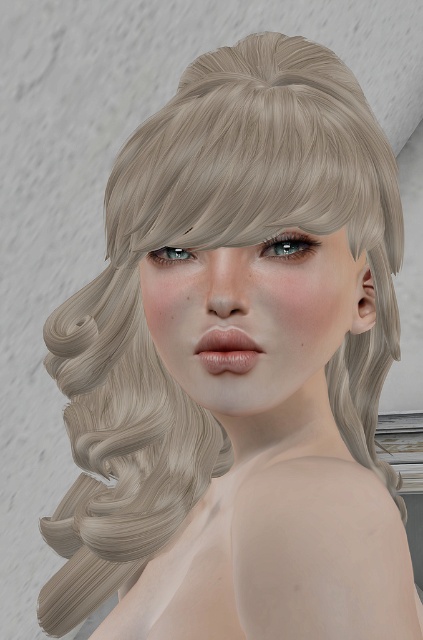
Question: Which point is closer to the camera?

Choices:
 (A) (156, 252)
 (B) (296, 248)

Answer: (B)

Question: Can you confirm if sleek blonde hair at center is positioned above satin blue eye at center?

Choices:
 (A) no
 (B) yes

Answer: (B)

Question: Does sleek blonde hair at center have a smaller size compared to satin blue eye at upper center?

Choices:
 (A) no
 (B) yes

Answer: (A)

Question: Considering the relative positions of sleek blonde hair at center and satin blue eye at upper center in the image provided, where is sleek blonde hair at center located with respect to satin blue eye at upper center?

Choices:
 (A) below
 (B) above

Answer: (B)

Question: Which object appears farthest from the camera in this image?

Choices:
 (A) satin blue eye at upper center
 (B) sleek blonde hair at center
 (C) satin blue eye at center

Answer: (A)

Question: Among these points, which one is farthest from the camera?

Choices:
 (A) (178, 252)
 (B) (203, 100)

Answer: (B)